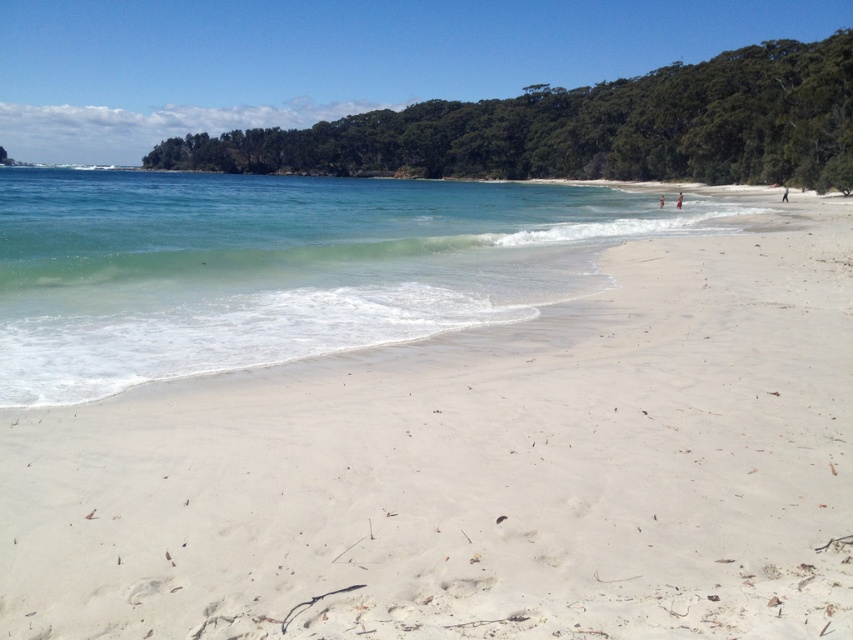
Question: Does white sandy beach at center come behind clear water at lower left?

Choices:
 (A) yes
 (B) no

Answer: (B)

Question: Can you confirm if white sandy beach at center is bigger than clear water at lower left?

Choices:
 (A) yes
 (B) no

Answer: (B)

Question: Which object appears farthest from the camera in this image?

Choices:
 (A) clear water at lower left
 (B) white sandy beach at center

Answer: (A)

Question: Does white sandy beach at center have a greater width compared to clear water at lower left?

Choices:
 (A) no
 (B) yes

Answer: (A)